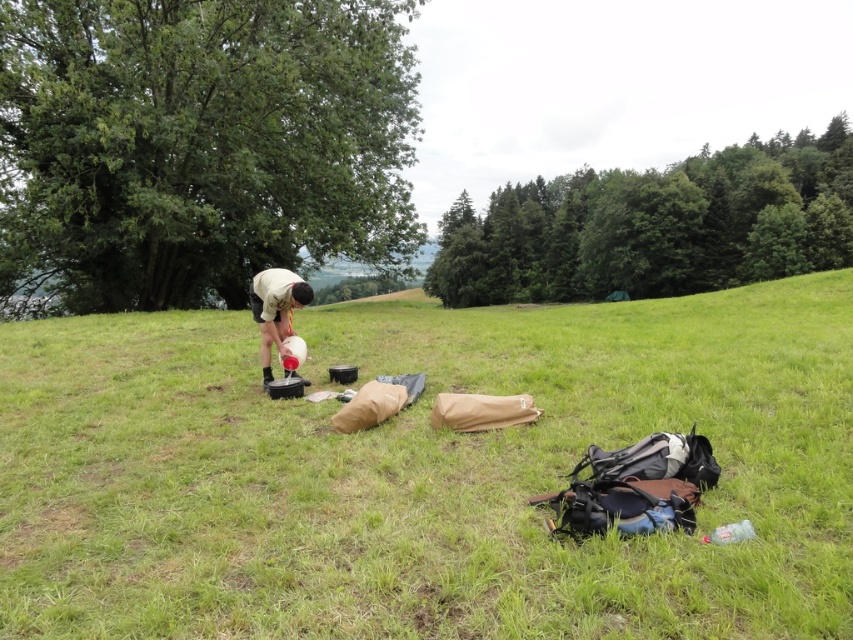
Question: Which object appears closest to the camera in this image?

Choices:
 (A) green grassy field at center
 (B) white matte shirt at center

Answer: (A)

Question: Can you confirm if green grassy field at center is smaller than white matte shirt at center?

Choices:
 (A) yes
 (B) no

Answer: (B)

Question: Among these objects, which one is farthest from the camera?

Choices:
 (A) green grassy field at center
 (B) white matte shirt at center

Answer: (B)

Question: Is green grassy field at center positioned before white matte shirt at center?

Choices:
 (A) no
 (B) yes

Answer: (B)

Question: Is green grassy field at center to the right of white matte shirt at center from the viewer's perspective?

Choices:
 (A) no
 (B) yes

Answer: (B)